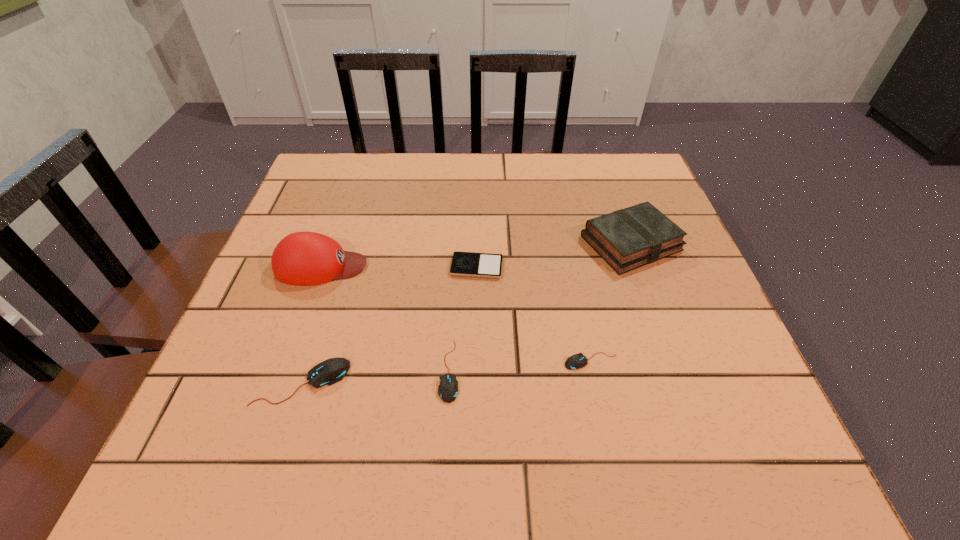
Where is `the tallest mouse`? Image resolution: width=960 pixels, height=540 pixels. the tallest mouse is located at coordinates (333, 370).

Identify the location of the third tallest object. (333, 370).

Find the location of `the fourth tallest object`. the fourth tallest object is located at coordinates (447, 390).

Locate an element on the screen. Image resolution: width=960 pixels, height=540 pixels. the second mouse from right to left is located at coordinates (447, 390).

Find the location of `the fifth tallest object`. the fifth tallest object is located at coordinates (576, 361).

Image resolution: width=960 pixels, height=540 pixels. I want to click on the rightmost mouse, so 576,361.

Locate an element on the screen. The width and height of the screenshot is (960, 540). book is located at coordinates [629, 238].

Identify the location of baseball cap. This screenshot has width=960, height=540. (304, 258).

Identify the location of iPod. This screenshot has width=960, height=540. (x=469, y=264).

Identify the location of vacant space located on the back of the leftmost mouse. (318, 332).